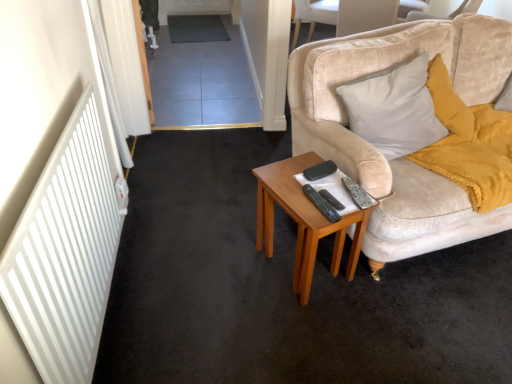
Question: Is black plastic remote control at center, which ranks as the 2th remote control in left-to-right order, positioned before black plastic remote control at center, marked as the 3th remote control in a right-to-left arrangement?

Choices:
 (A) no
 (B) yes

Answer: (A)

Question: Can you see black plastic remote control at center, which is the second remote control from right to left, touching black plastic remote control at center, marked as the 3th remote control in a right-to-left arrangement?

Choices:
 (A) no
 (B) yes

Answer: (B)

Question: Is black plastic remote control at center, the 1th remote control when ordered from left to right, at the back of black plastic remote control at center, which is the second remote control from right to left?

Choices:
 (A) yes
 (B) no

Answer: (B)

Question: Does black plastic remote control at center, which ranks as the 2th remote control in left-to-right order, have a smaller size compared to black plastic remote control at center, the 1th remote control when ordered from left to right?

Choices:
 (A) yes
 (B) no

Answer: (A)

Question: Does black plastic remote control at center, which ranks as the 2th remote control in left-to-right order, appear on the right side of black plastic remote control at center, the 1th remote control when ordered from left to right?

Choices:
 (A) yes
 (B) no

Answer: (A)

Question: Considering their positions, is silver metallic remote control at right, positioned as the 3th remote control in left-to-right order, located in front of or behind black plastic remote control at center, marked as the 3th remote control in a right-to-left arrangement?

Choices:
 (A) front
 (B) behind

Answer: (B)

Question: From the image's perspective, is silver metallic remote control at right, positioned as the 3th remote control in left-to-right order, above or below black plastic remote control at center, marked as the 3th remote control in a right-to-left arrangement?

Choices:
 (A) below
 (B) above

Answer: (B)

Question: Does point (368, 198) appear closer or farther from the camera than point (306, 195)?

Choices:
 (A) farther
 (B) closer

Answer: (B)

Question: In the image, is silver metallic remote control at right, positioned as the 3th remote control in left-to-right order, on the left side or the right side of black plastic remote control at center, marked as the 3th remote control in a right-to-left arrangement?

Choices:
 (A) left
 (B) right

Answer: (B)

Question: Would you say woodenobject at center is inside or outside velvet beige pillow at right?

Choices:
 (A) inside
 (B) outside

Answer: (B)

Question: From the image's perspective, is woodenobject at center above or below velvet beige pillow at right?

Choices:
 (A) above
 (B) below

Answer: (B)

Question: Considering the positions of woodenobject at center and velvet beige pillow at right in the image, is woodenobject at center wider or thinner than velvet beige pillow at right?

Choices:
 (A) thin
 (B) wide

Answer: (B)

Question: Does point (354, 238) appear closer or farther from the camera than point (411, 129)?

Choices:
 (A) farther
 (B) closer

Answer: (B)

Question: Is velvet beige chair at upper center to the left or to the right of dark gray carpet at center in the image?

Choices:
 (A) left
 (B) right

Answer: (B)

Question: In terms of height, does velvet beige chair at upper center look taller or shorter compared to dark gray carpet at center?

Choices:
 (A) tall
 (B) short

Answer: (A)